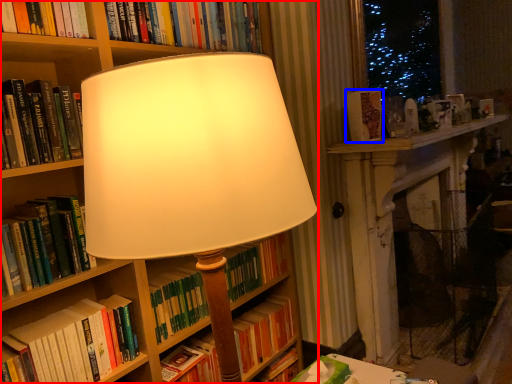
Question: Which of the following is the farthest to the observer, bookcase (highlighted by a red box) or book (highlighted by a blue box)?

Choices:
 (A) bookcase
 (B) book

Answer: (B)